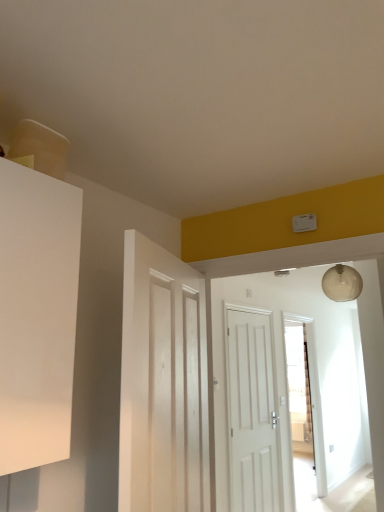
Question: Can you confirm if white wooden door at center, which ranks as the 1th door in front-to-back order, is wider than transparent glass door at center?

Choices:
 (A) no
 (B) yes

Answer: (B)

Question: From a real-world perspective, is white wooden door at center, which ranks as the 1th door in front-to-back order, positioned under transparent glass door at center based on gravity?

Choices:
 (A) yes
 (B) no

Answer: (B)

Question: Is white wooden door at center, the second door in the back-to-front sequence, at the right side of transparent glass door at center?

Choices:
 (A) no
 (B) yes

Answer: (A)

Question: From the image's perspective, is white wooden door at center, which ranks as the 1th door in front-to-back order, under transparent glass door at center?

Choices:
 (A) no
 (B) yes

Answer: (A)

Question: Considering the relative sizes of white wooden door at center, which ranks as the 1th door in front-to-back order, and transparent glass door at center in the image provided, is white wooden door at center, which ranks as the 1th door in front-to-back order, shorter than transparent glass door at center?

Choices:
 (A) no
 (B) yes

Answer: (B)

Question: From the image's perspective, is white matte door at center, the 2th door positioned from the front, above or below transparent glass door at center?

Choices:
 (A) below
 (B) above

Answer: (B)

Question: Is white matte door at center, the first door when ordered from right to left, wider or thinner than transparent glass door at center?

Choices:
 (A) thin
 (B) wide

Answer: (A)

Question: From a real-world perspective, is white matte door at center, which ranks as the 1th door in back-to-front order, above or below transparent glass door at center?

Choices:
 (A) below
 (B) above

Answer: (B)

Question: Looking at the image, does white matte door at center, the first door when ordered from right to left, seem bigger or smaller compared to transparent glass door at center?

Choices:
 (A) big
 (B) small

Answer: (B)

Question: Does point (180, 416) appear closer or farther from the camera than point (271, 324)?

Choices:
 (A) closer
 (B) farther

Answer: (A)

Question: Is white wooden door at center, marked as the first door in a left-to-right arrangement, taller or shorter than white matte door at center, the first door when ordered from right to left?

Choices:
 (A) short
 (B) tall

Answer: (A)

Question: Based on their sizes in the image, would you say white wooden door at center, the second door in the back-to-front sequence, is bigger or smaller than white matte door at center, the first door when ordered from right to left?

Choices:
 (A) big
 (B) small

Answer: (A)

Question: Is white wooden door at center, marked as the first door in a left-to-right arrangement, in front of or behind white matte door at center, the 2th door positioned from the front, in the image?

Choices:
 (A) front
 (B) behind

Answer: (A)

Question: Based on their sizes in the image, would you say white wooden door at center, which is counted as the second door, starting from the right, is bigger or smaller than transparent glass door at center?

Choices:
 (A) big
 (B) small

Answer: (B)

Question: Is white wooden door at center, which is counted as the second door, starting from the right, to the left or to the right of transparent glass door at center in the image?

Choices:
 (A) right
 (B) left

Answer: (B)